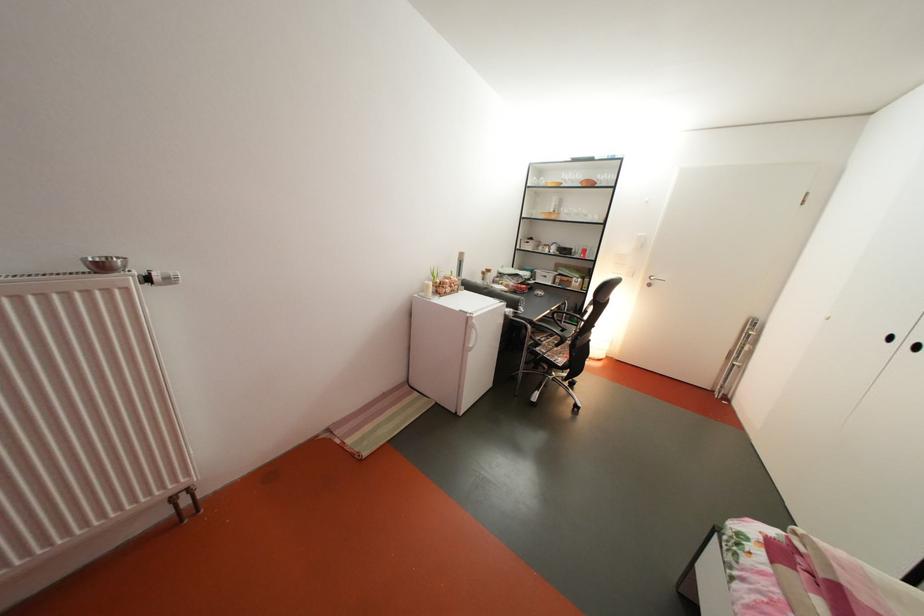
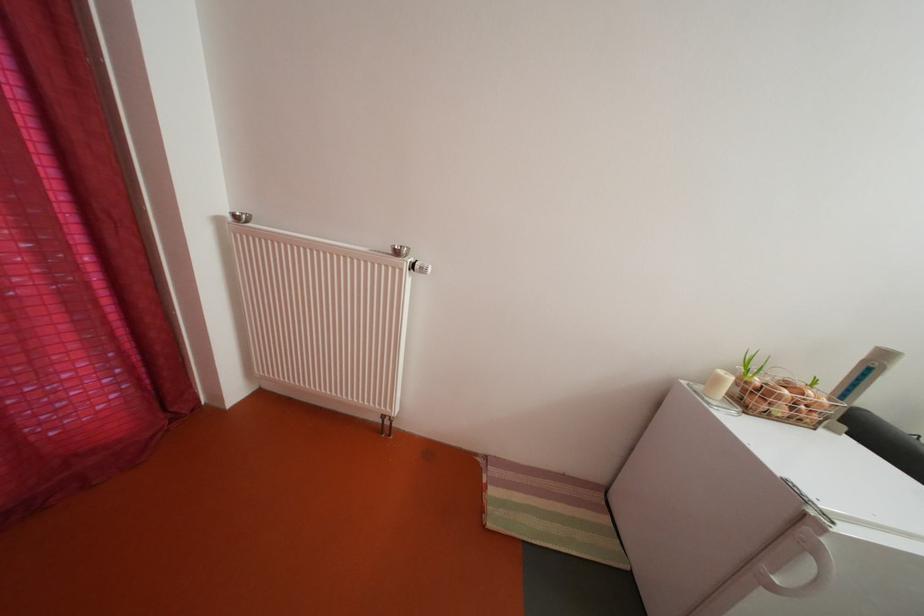
Find the pixel in the second image that matches (x=439, y=293) in the first image.

(728, 386)